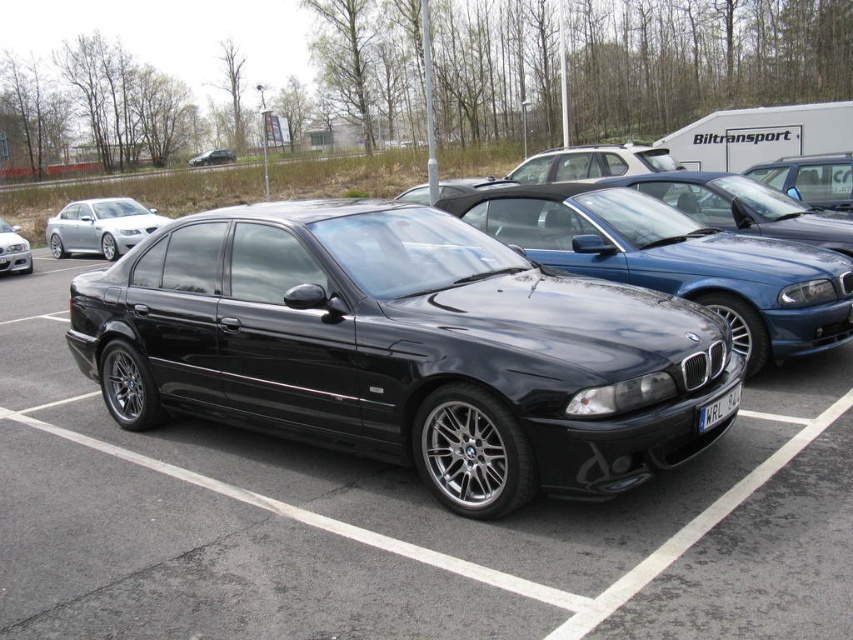
You are standing at the point marked by the coordinates point [675,260] in the parking lot. Which car is directly in front of you?

The point [675,260] corresponds to the glossy black car at center, so the glossy black car at center is directly in front of you.

You are a delivery person needing to move a 15 meter long truck between the glossy black car at center and the satin silver sedan at left. Can the truck fit through the space between them?

The distance between the glossy black car at center and the satin silver sedan at left is 15.16 meters, so the truck can fit through the space between them since it is slightly longer than the truck.